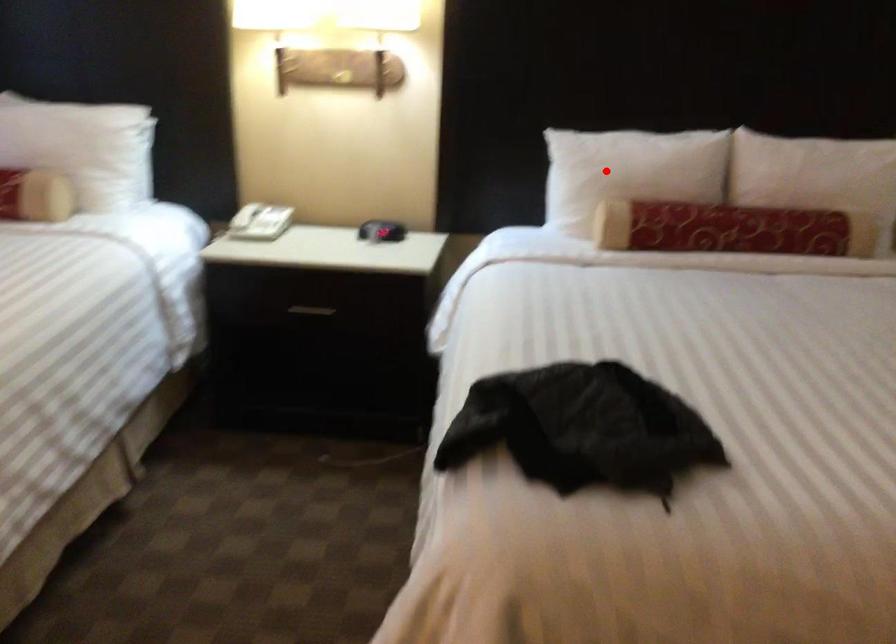
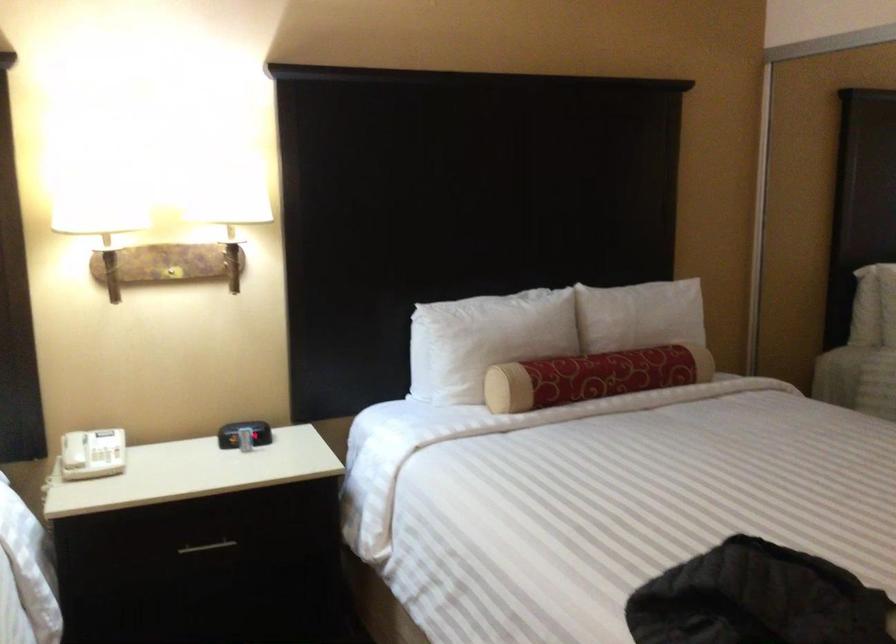
In the second image, find the point that corresponds to the highlighted location in the first image.

(485, 339)